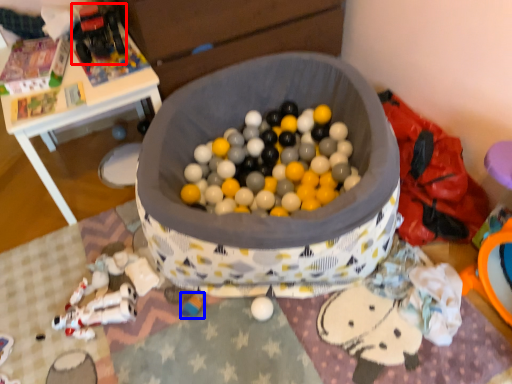
Question: Which object is further to the camera taking this photo, toy (highlighted by a red box) or toy (highlighted by a blue box)?

Choices:
 (A) toy
 (B) toy

Answer: (A)